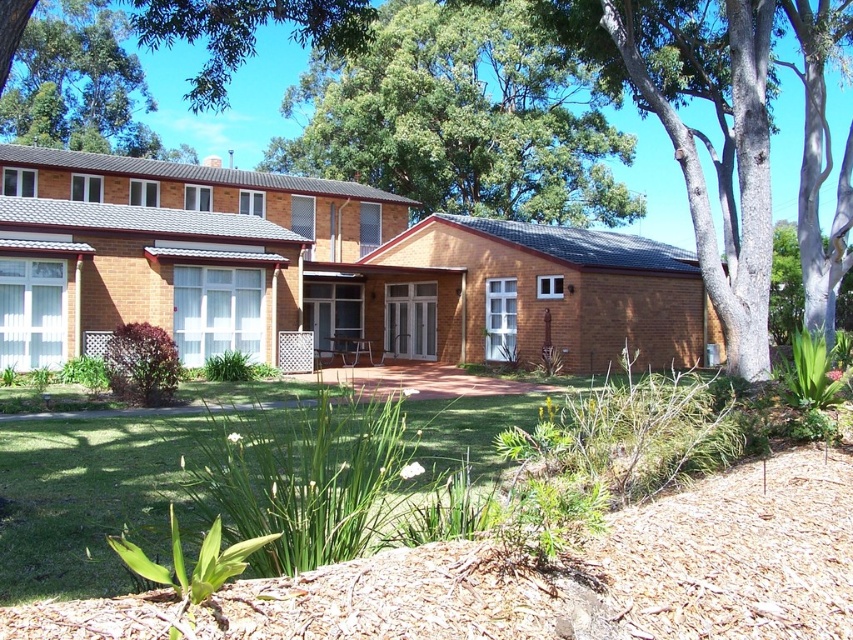
Is green grass at lower left shorter than green leafy tree at upper left?

Yes.

Does green grass at lower left have a larger size compared to green leafy tree at upper left?

Incorrect, green grass at lower left is not larger than green leafy tree at upper left.

Is point (216, 396) positioned before point (50, 60)?

Yes, point (216, 396) is closer to viewer.

Where is `green grass at lower left`? This screenshot has height=640, width=853. green grass at lower left is located at coordinates (91, 499).

Who is higher up, green leafy tree at upper center or green leafy tree at upper left?

green leafy tree at upper left

I want to click on green leafy tree at upper center, so (462, 118).

Does point (514, 88) come farther from viewer compared to point (105, 38)?

Yes, point (514, 88) is behind point (105, 38).

At what (x,y) coordinates should I click in order to perform the action: click on green leafy tree at upper center. Please return your answer as a coordinate pair (x, y). Looking at the image, I should click on (462, 118).

Does brown textured tree at center have a greater width compared to green grass at lower left?

Yes.

Who is positioned more to the left, brown textured tree at center or green grass at lower left?

green grass at lower left is more to the left.

The width and height of the screenshot is (853, 640). I want to click on brown textured tree at center, so click(x=726, y=138).